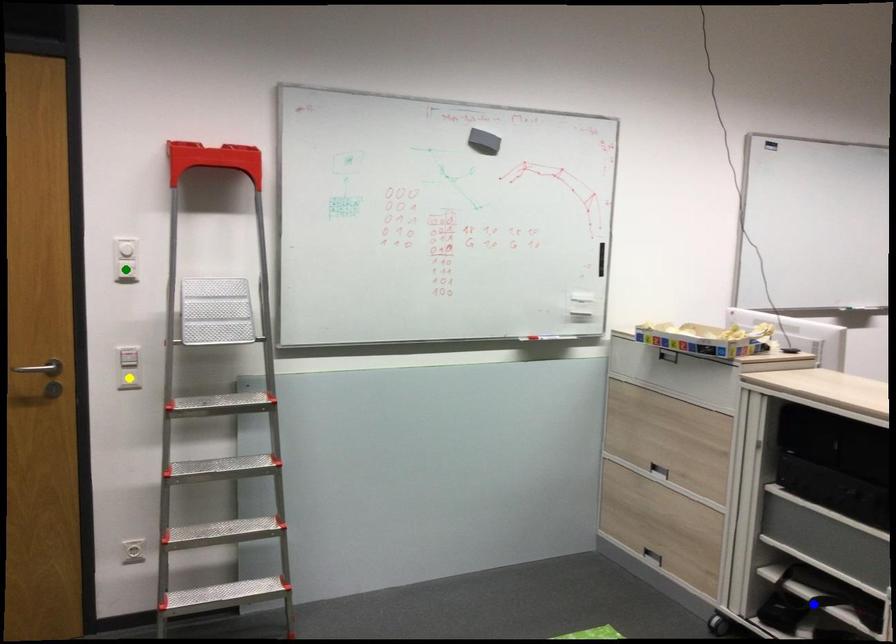
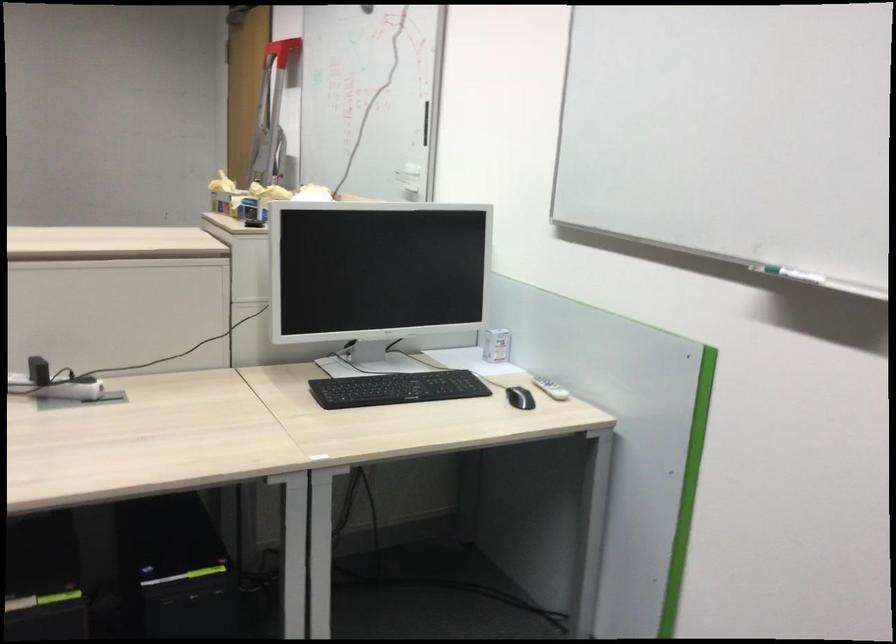
I am providing you with two images of the same scene from different viewpoints. Three points are marked in image1. Which point corresponds to a part or object that is occluded in image2?In image1, three points are marked. Which of them correspond to a part or object that is occluded in image2?Among the three points shown in image1, which one corresponds to a part or object that is no longer visible due to occlusion in image2?

Invisible in image2: blue point, yellow point, green point.